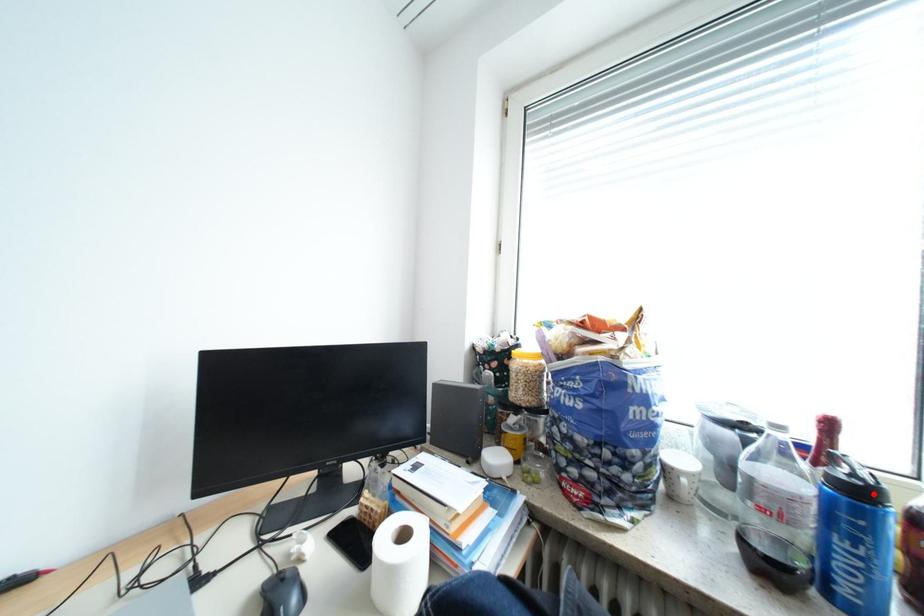
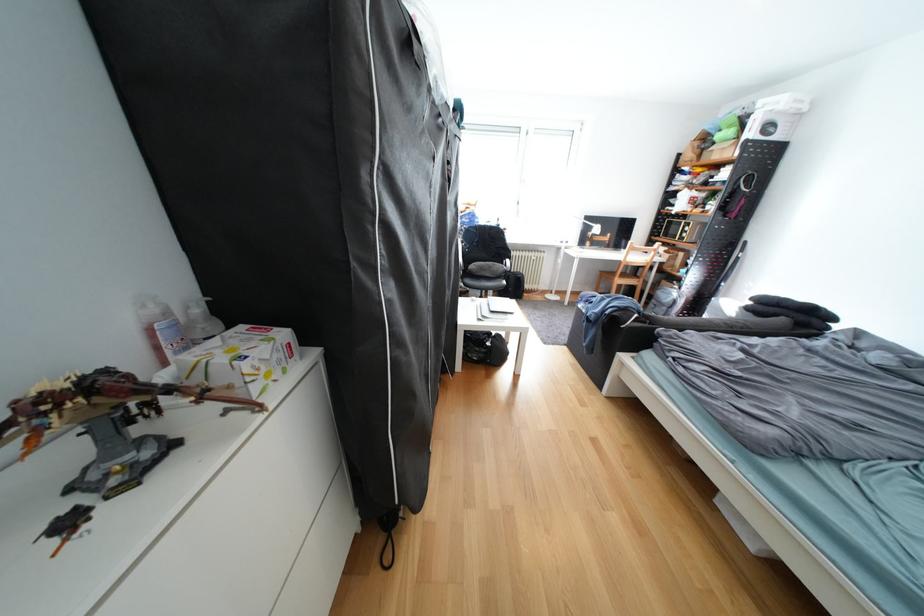
Question: I am providing you with two images of the same scene from different viewpoints. A red point is marked on the first image. At the location where the point appears in image 1, is it still visible in image 2?

Choices:
 (A) Yes
 (B) No

Answer: (B)